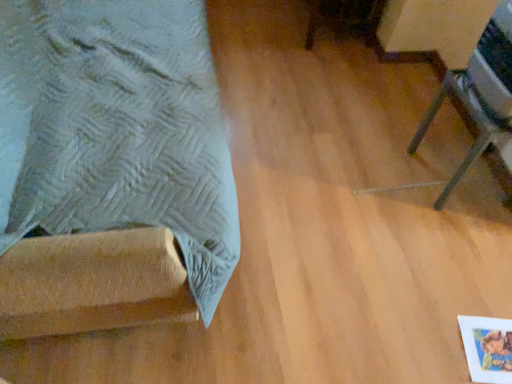
Identify the location of vacant space that is to the left of metallic silver tripod at right, the first furniture from the right. tap(384, 167).